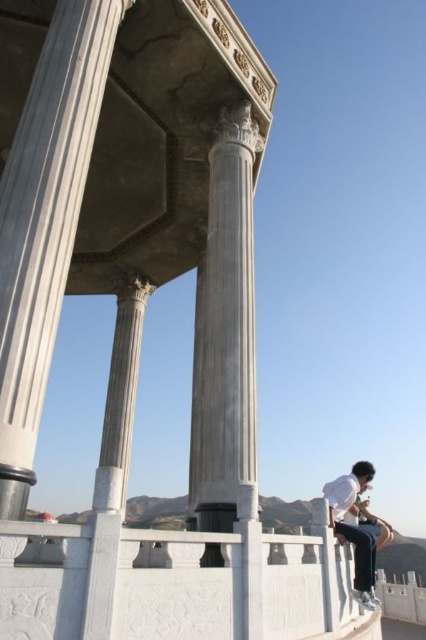
Between white marble pillar at center and white matte shirt at lower right, which one appears on the right side from the viewer's perspective?

white matte shirt at lower right

Who is taller, white marble pillar at center or white matte shirt at lower right?

Standing taller between the two is white matte shirt at lower right.

Between point (9, 266) and point (333, 492), which one is positioned behind?

Positioned behind is point (333, 492).

Image resolution: width=426 pixels, height=640 pixels. Identify the location of white marble pillar at center. (45, 220).

Is white marble column at center shorter than white matte shirt at lower right?

Yes.

Is point (241, 301) positioned in front of point (354, 502)?

That is False.

Locate an element on the screen. white marble column at center is located at coordinates (227, 328).

Does white marble pillar at center lie behind white marble column at center?

No, it is in front of white marble column at center.

Which of these two, white marble pillar at center or white marble column at center, stands taller?

With more height is white marble pillar at center.

Between point (92, 115) and point (218, 333), which one is positioned in front?

Point (92, 115) is more forward.

You are a GUI agent. You are given a task and a screenshot of the screen. Output one action in this format:
    pyautogui.click(x=<x>, y=<y>)
    Task: Click on the white marble pillar at center
    
    Given the screenshot: What is the action you would take?
    pyautogui.click(x=45, y=220)